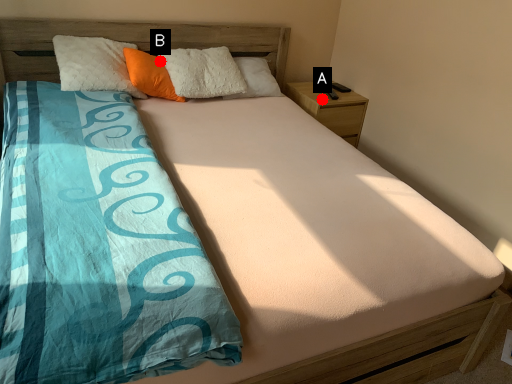
Question: Two points are circled on the image, labeled by A and B beside each circle. Among these points, which one is nearest to the camera?

Choices:
 (A) A is closer
 (B) B is closer

Answer: (B)